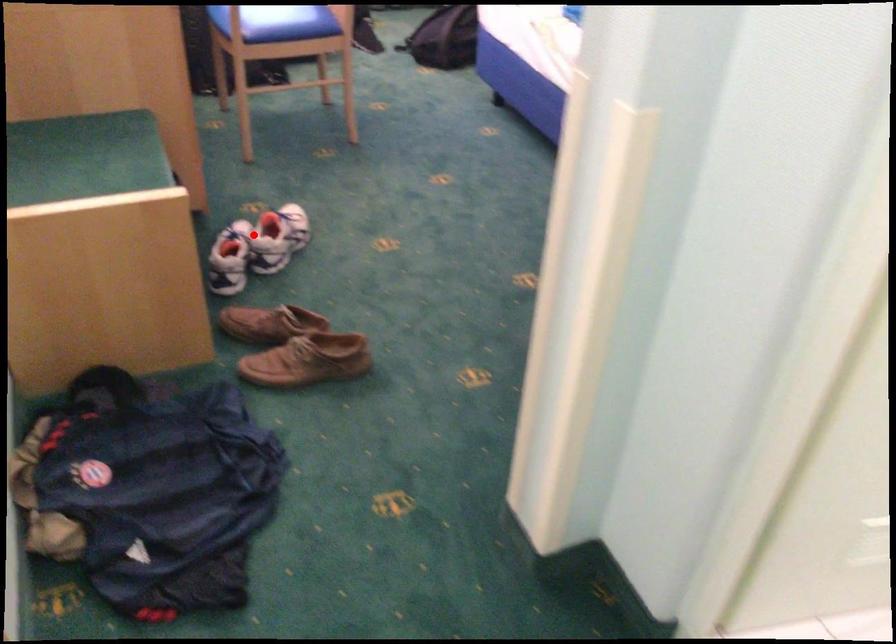
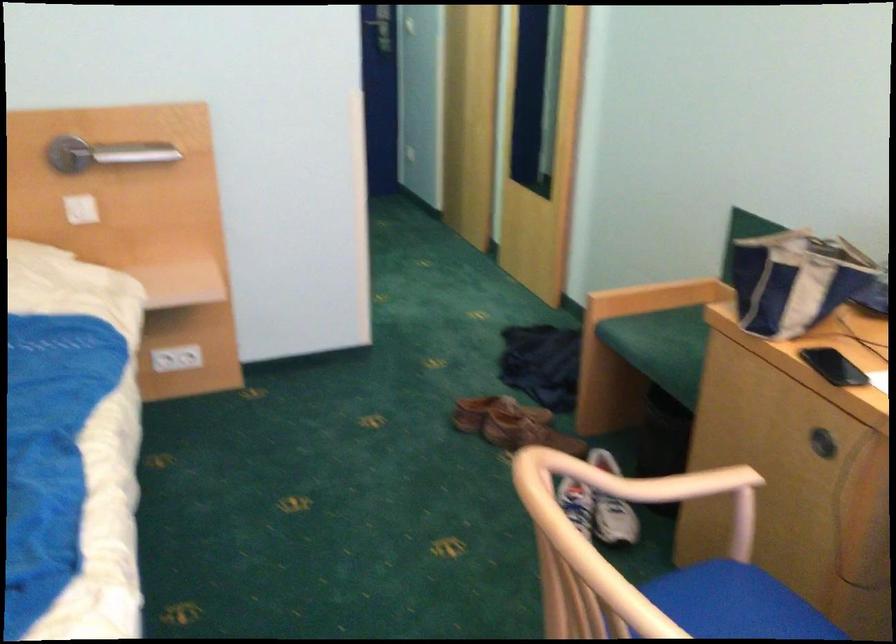
In the second image, find the point that corresponds to the highlighted location in the first image.

(607, 543)